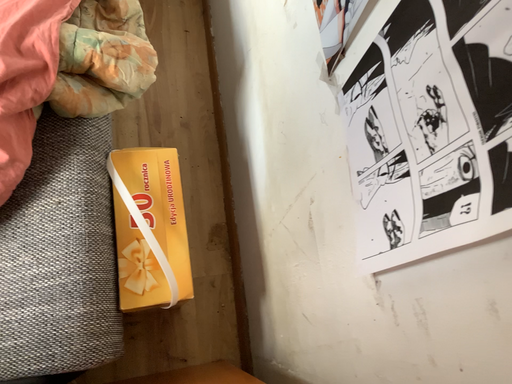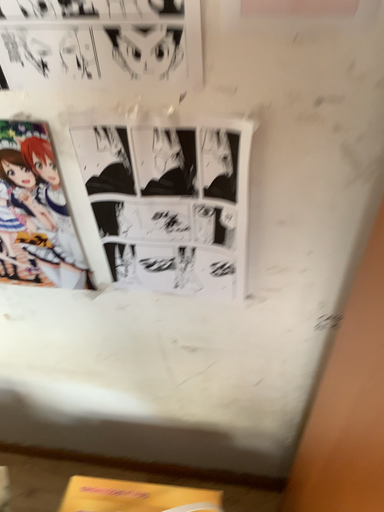
Question: How did the camera likely rotate when shooting the video?

Choices:
 (A) rotated downward
 (B) rotated upward

Answer: (B)